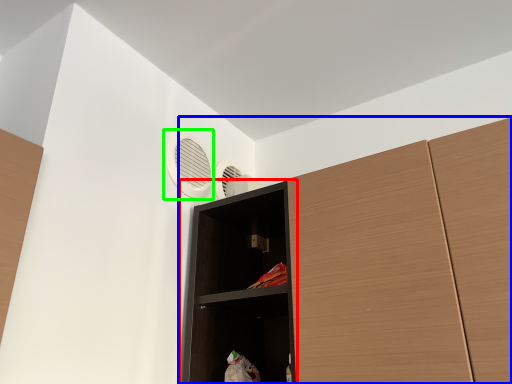
Question: Which object is positioned closest to shelf (highlighted by a red box)? Select from cupboard (highlighted by a blue box) and air conditioning (highlighted by a green box).

Choices:
 (A) cupboard
 (B) air conditioning

Answer: (A)